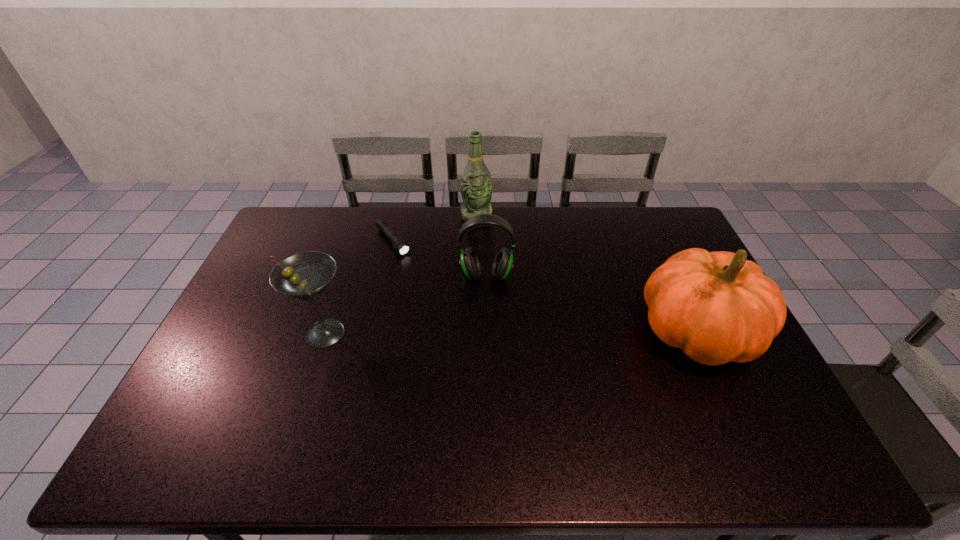
Locate an element on the screen. The height and width of the screenshot is (540, 960). free space located on the ear cups of the third farthest object is located at coordinates (484, 321).

Identify the location of vacant point located 0.160m at the lens end of the flashlight. (424, 282).

You are a GUI agent. You are given a task and a screenshot of the screen. Output one action in this format:
    pyautogui.click(x=<x>, y=<y>)
    Task: Click on the vacant space located 0.360m at the lens end of the flashlight
    The width and height of the screenshot is (960, 540).
    Given the screenshot: What is the action you would take?
    pyautogui.click(x=457, y=320)

In order to click on free spot located at the lens end of the flashlight in this screenshot , I will do `click(446, 308)`.

Where is `vacant space located 0.390m on the surface of the beer bottle`? The image size is (960, 540). vacant space located 0.390m on the surface of the beer bottle is located at coordinates (497, 300).

Where is `vacant space situated on the surface of the beer bottle`? The width and height of the screenshot is (960, 540). vacant space situated on the surface of the beer bottle is located at coordinates pyautogui.click(x=489, y=262).

The image size is (960, 540). I want to click on free region located 0.320m on the surface of the beer bottle, so click(493, 284).

Locate an element on the screen. The image size is (960, 540). flashlight situated at the far edge is located at coordinates (399, 244).

The height and width of the screenshot is (540, 960). In order to click on beer bottle present at the far edge in this screenshot , I will do `click(476, 187)`.

Where is `object that is positioned at the right edge`? This screenshot has width=960, height=540. object that is positioned at the right edge is located at coordinates [x=717, y=307].